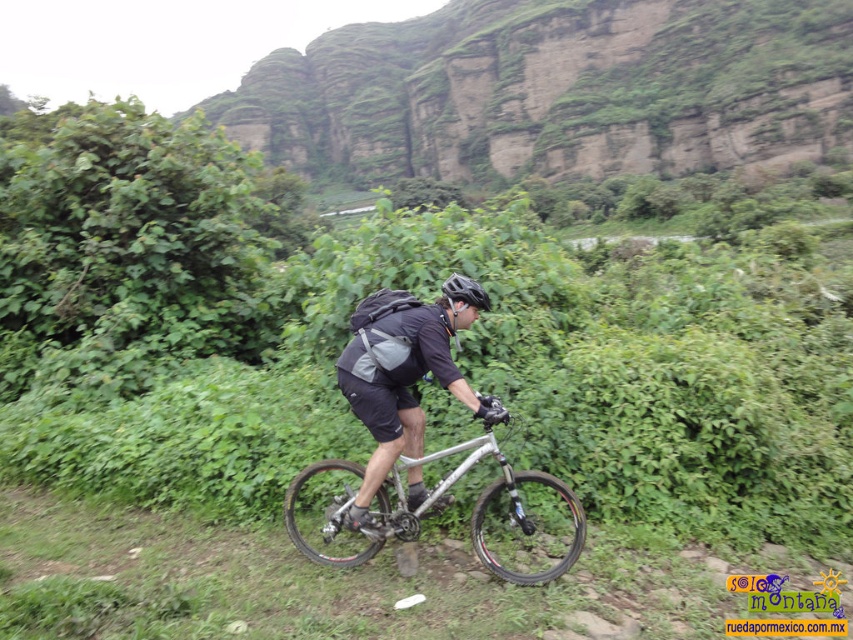
Who is taller, green mossy rock at upper center or silver metallic bicycle at center?

green mossy rock at upper center is taller.

Does point (410, 33) come in front of point (521, 506)?

That is False.

Which is in front, point (412, 97) or point (347, 532)?

Point (347, 532)

Find the location of a particular element. green mossy rock at upper center is located at coordinates (553, 90).

Does green leafy vegetation at center have a greater height compared to silver metallic bicycle at center?

Indeed, green leafy vegetation at center has a greater height compared to silver metallic bicycle at center.

Which is behind, point (476, 216) or point (548, 474)?

Point (476, 216)

What do you see at coordinates (347, 337) in the screenshot? I see `green leafy vegetation at center` at bounding box center [347, 337].

Locate an element on the screen. This screenshot has height=640, width=853. green leafy vegetation at center is located at coordinates (347, 337).

Between green mossy rock at upper center and black matte helmet at center, which one is positioned higher?

green mossy rock at upper center is higher up.

Who is shorter, green mossy rock at upper center or black matte helmet at center?

black matte helmet at center

Where is `green mossy rock at upper center`? The width and height of the screenshot is (853, 640). green mossy rock at upper center is located at coordinates (553, 90).